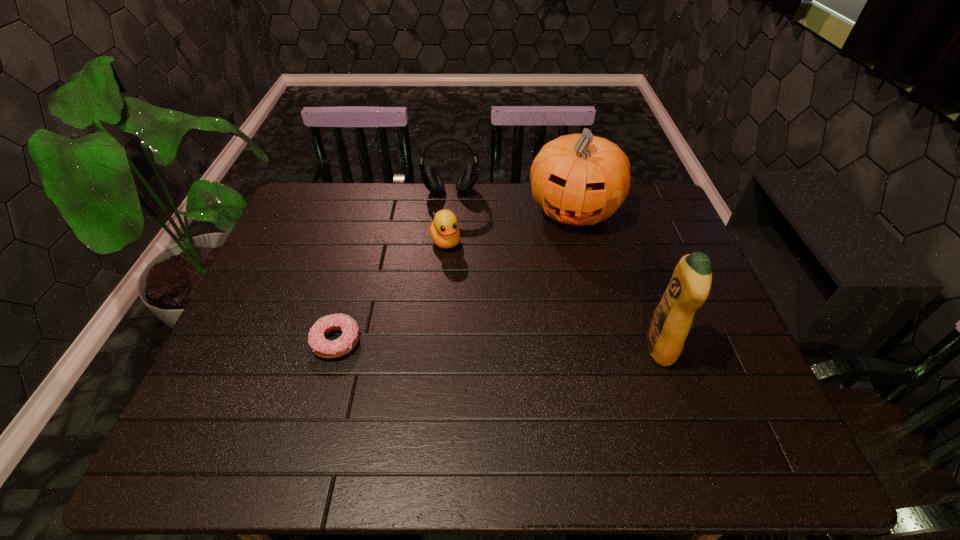
This screenshot has height=540, width=960. Identify the location of free space between the third tallest object and the detergent. (555, 269).

Find the location of a particular element. Image resolution: width=960 pixels, height=540 pixels. vacant area that lies between the leftmost object and the fourth tallest object is located at coordinates (391, 292).

Identify the location of free space between the leftmost object and the detergent. (498, 344).

This screenshot has height=540, width=960. I want to click on empty space that is in between the pumpkin and the leftmost object, so click(x=455, y=275).

The width and height of the screenshot is (960, 540). I want to click on free space between the leftmost object and the second shortest object, so [x=391, y=292].

At what (x,y) coordinates should I click in order to perform the action: click on free space between the detergent and the pumpkin. Please return your answer as a coordinate pair (x, y). This screenshot has height=540, width=960. Looking at the image, I should click on (616, 279).

Find the location of a particular element. unoccupied area between the pumpkin and the second shortest object is located at coordinates (510, 226).

The width and height of the screenshot is (960, 540). I want to click on object that is the closest to the doughnut, so click(444, 231).

Locate an element on the screen. This screenshot has width=960, height=540. object that is the second closest one to the doughnut is located at coordinates (431, 178).

At what (x,y) coordinates should I click in order to perform the action: click on vacant position in the image that satisfies the following two spatial constraints: 1. on the front side of the third shortest object; 2. on the label of the detergent. Please return your answer as a coordinate pair (x, y). The width and height of the screenshot is (960, 540). Looking at the image, I should click on (x=438, y=347).